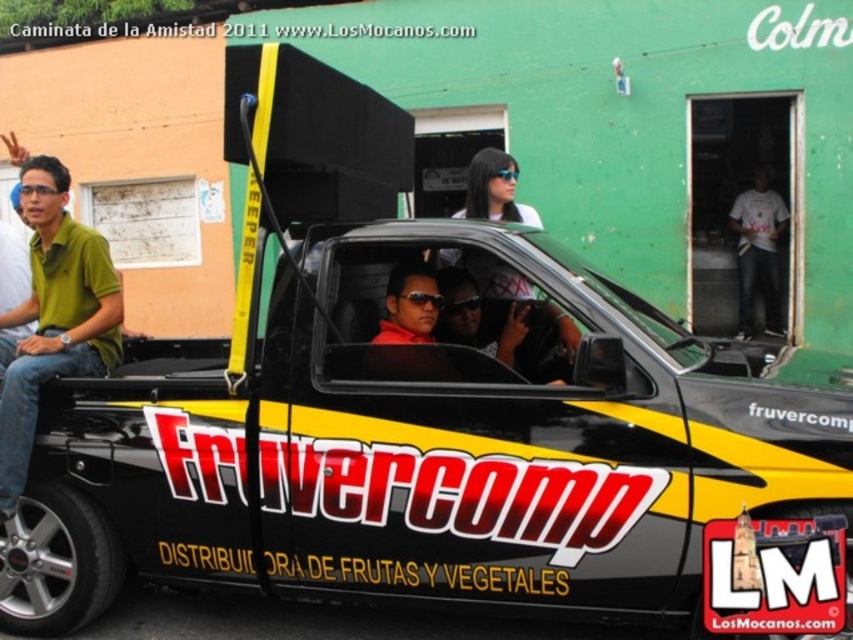
You are a delivery person standing at point (775, 280) and need to reach point (32, 339). Is there a clear path between these two points without any obstacles?

Point (32, 339) is in front of point (775, 280), so there is a clear path between them if there are no obstacles blocking the way.